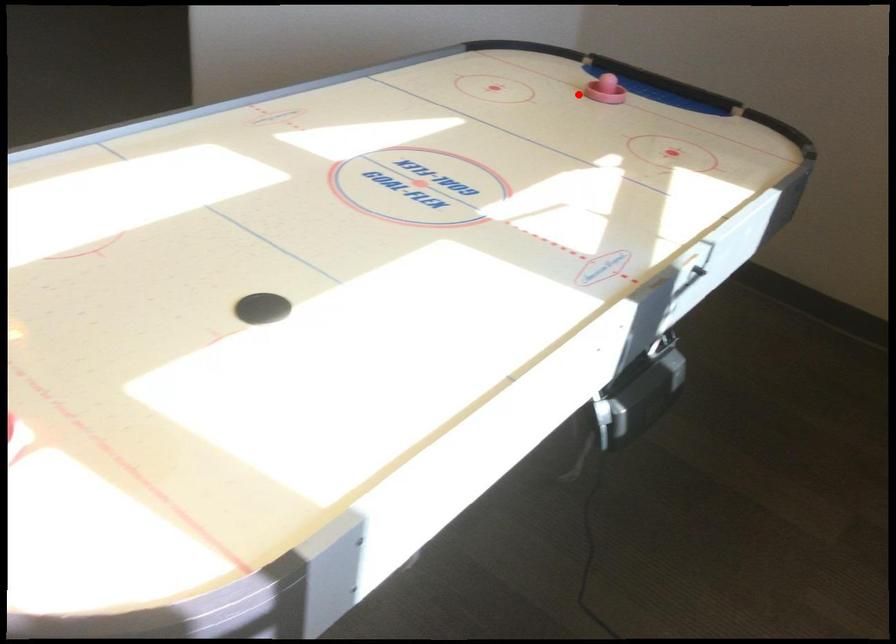
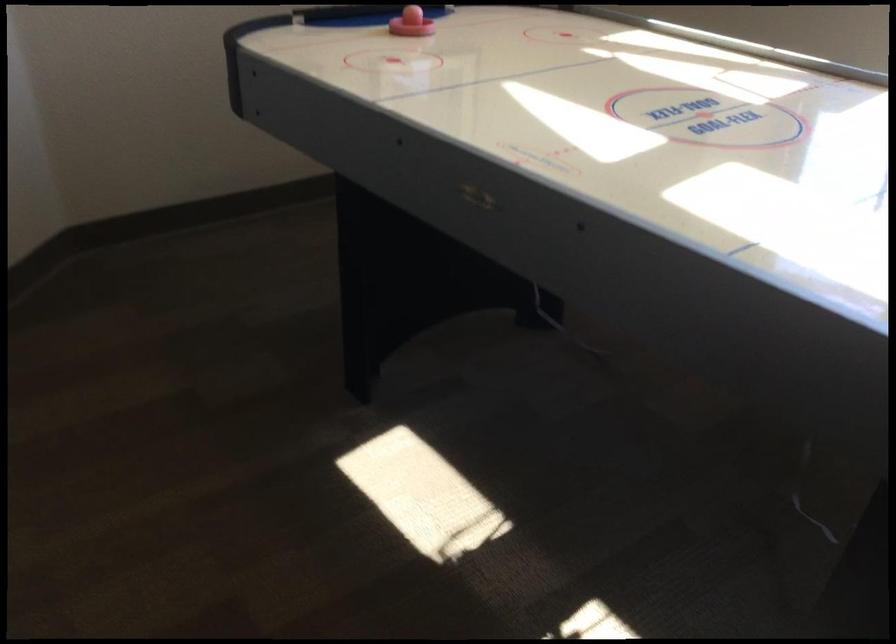
The point at the highlighted location is marked in the first image. Where is the corresponding point in the second image?

(410, 23)